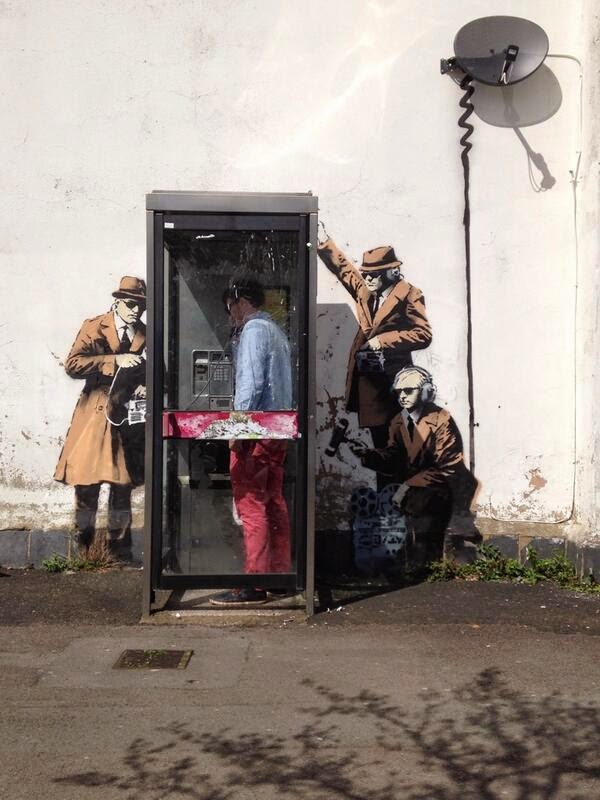
Locate an element on the screen. The height and width of the screenshot is (800, 600). grate is located at coordinates (171, 649).